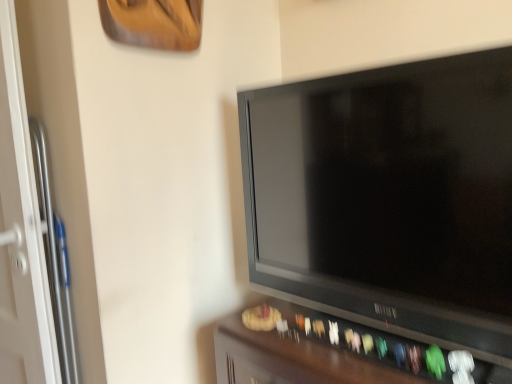
Question: Is point (263, 322) closer or farther from the camera than point (282, 215)?

Choices:
 (A) farther
 (B) closer

Answer: (B)

Question: Relative to black glossy tv at center, is dark wood tv stand at lower center in front or behind?

Choices:
 (A) front
 (B) behind

Answer: (B)

Question: From a real-world perspective, is dark wood tv stand at lower center above or below black glossy tv at center?

Choices:
 (A) below
 (B) above

Answer: (A)

Question: From the image's perspective, is black glossy tv at center positioned above or below dark wood tv stand at lower center?

Choices:
 (A) below
 (B) above

Answer: (B)

Question: In terms of width, does black glossy tv at center look wider or thinner when compared to dark wood tv stand at lower center?

Choices:
 (A) wide
 (B) thin

Answer: (B)

Question: In terms of size, does black glossy tv at center appear bigger or smaller than dark wood tv stand at lower center?

Choices:
 (A) small
 (B) big

Answer: (A)

Question: Based on their positions, is black glossy tv at center located to the left or right of dark wood tv stand at lower center?

Choices:
 (A) left
 (B) right

Answer: (A)